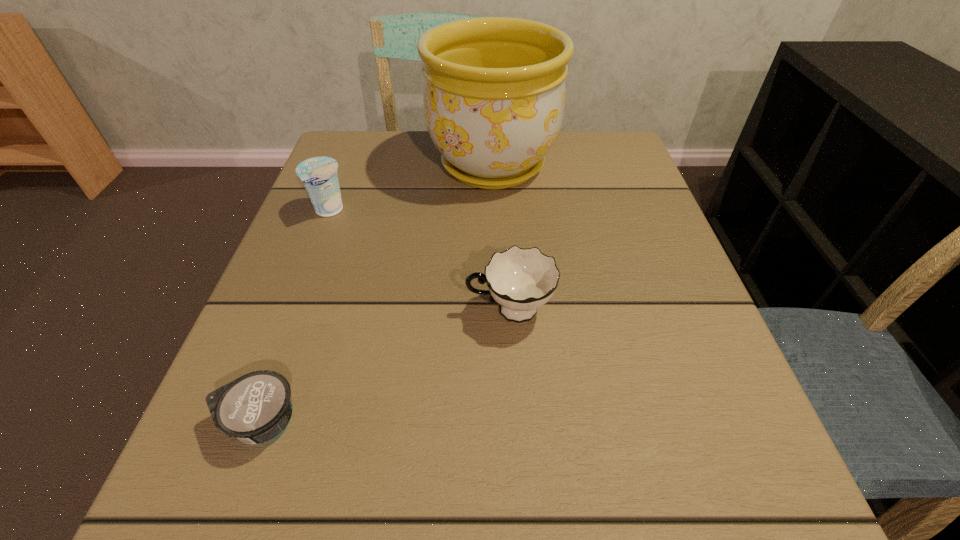
Locate an element on the screen. vacant region between the taller yogurt and the nearer yogurt is located at coordinates (295, 316).

Image resolution: width=960 pixels, height=540 pixels. Find the location of `object that ranks as the second closest to the tallest object`. object that ranks as the second closest to the tallest object is located at coordinates (521, 280).

Choose which object is the third nearest neighbor to the nearer yogurt. Please provide its 2D coordinates. Your answer should be formatted as a tuple, i.e. [(x, y)], where the tuple contains the x and y coordinates of a point satisfying the conditions above.

[(494, 93)]

You are a GUI agent. You are given a task and a screenshot of the screen. Output one action in this format:
    pyautogui.click(x=<x>, y=<y>)
    Task: Click on the vacant space that satisfies the following two spatial constraints: 1. on the back side of the nearest object; 2. on the side of the third farthest object with the handle
    Image resolution: width=960 pixels, height=540 pixels.
    Given the screenshot: What is the action you would take?
    pyautogui.click(x=301, y=310)

The height and width of the screenshot is (540, 960). I want to click on free point that satisfies the following two spatial constraints: 1. on the back side of the farther yogurt; 2. on the right side of the tallest object, so (x=347, y=165).

I want to click on vacant space that satisfies the following two spatial constraints: 1. on the front side of the flowerpot; 2. on the side of the second nearest object with the handle, so click(x=498, y=310).